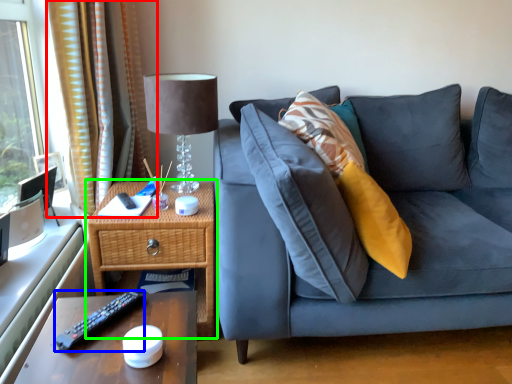
Question: Estimate the real-world distances between objects in this image. Which object is farther from curtain (highlighted by a red box), remote (highlighted by a blue box) or nightstand (highlighted by a green box)?

Choices:
 (A) remote
 (B) nightstand

Answer: (A)